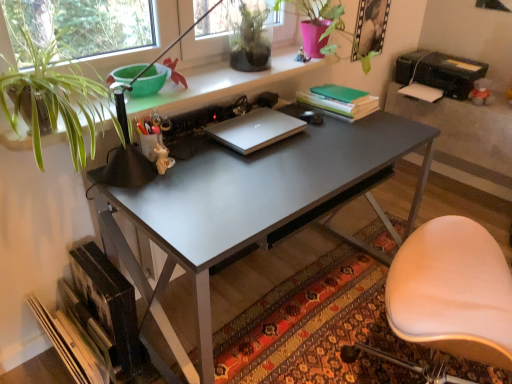
Where is `free space above silver metallic laptop at center (from a real-world perspective)`? This screenshot has width=512, height=384. free space above silver metallic laptop at center (from a real-world perspective) is located at coordinates [x=259, y=127].